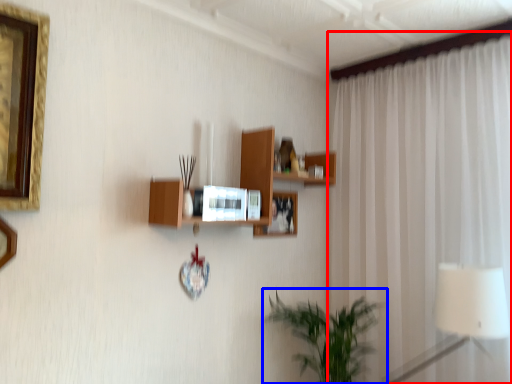
Question: Which of the following is the farthest to the observer, curtain (highlighted by a red box) or houseplant (highlighted by a blue box)?

Choices:
 (A) curtain
 (B) houseplant

Answer: (B)